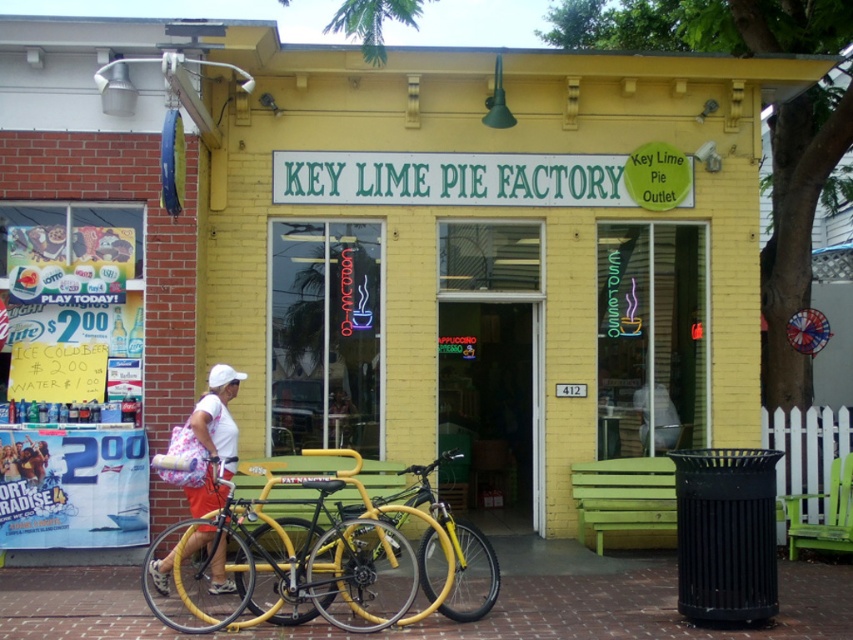
Question: Considering the real-world distances, which object is farthest from the yellow matte bicycle at center?

Choices:
 (A) yellow matte bicycle at lower left
 (B) white fabric bag at lower left

Answer: (B)

Question: Which point is farther from the camera taking this photo?

Choices:
 (A) (422, 548)
 (B) (181, 588)

Answer: (A)

Question: Does yellow matte bicycle at center have a lesser width compared to white fabric bag at lower left?

Choices:
 (A) no
 (B) yes

Answer: (A)

Question: Does yellow matte bicycle at lower left appear over white fabric bag at lower left?

Choices:
 (A) no
 (B) yes

Answer: (A)

Question: Which of the following is the closest to the observer?

Choices:
 (A) (165, 584)
 (B) (428, 582)

Answer: (B)

Question: Does yellow matte bicycle at center come behind white fabric bag at lower left?

Choices:
 (A) no
 (B) yes

Answer: (A)